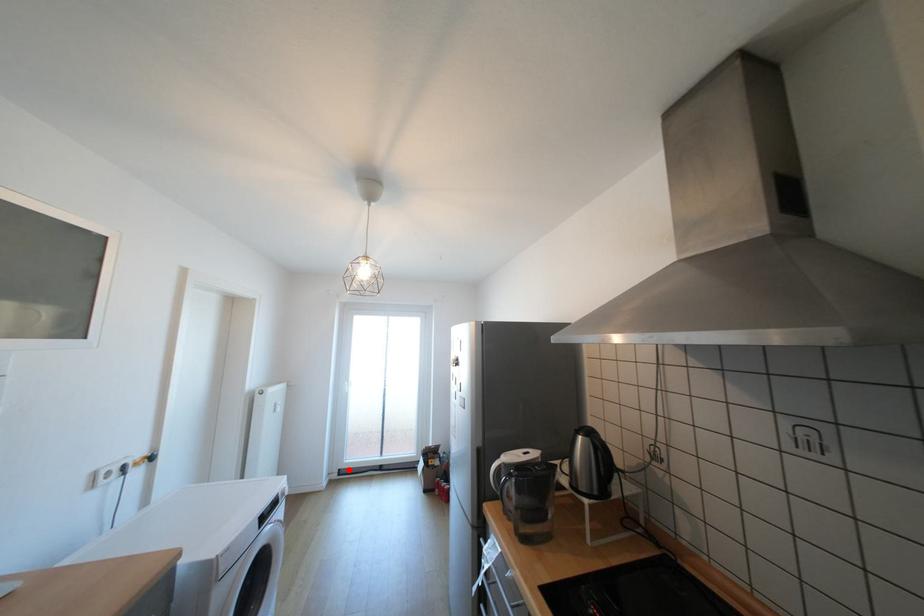
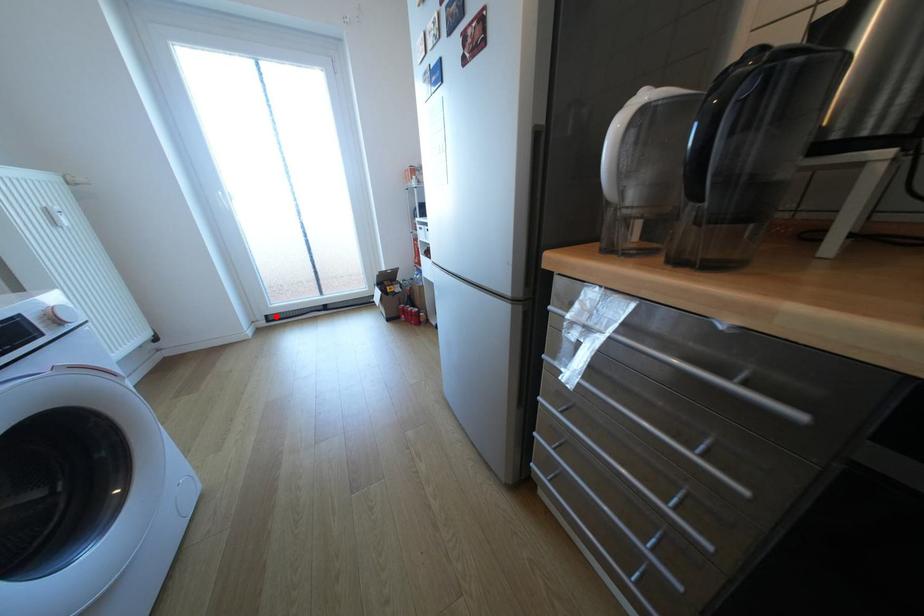
I am providing you with two images of the same scene from different viewpoints. A red point is marked on the first image and another point is marked on the second image. Are the points marked in image1 and image2 representing the same 3D position?

Yes